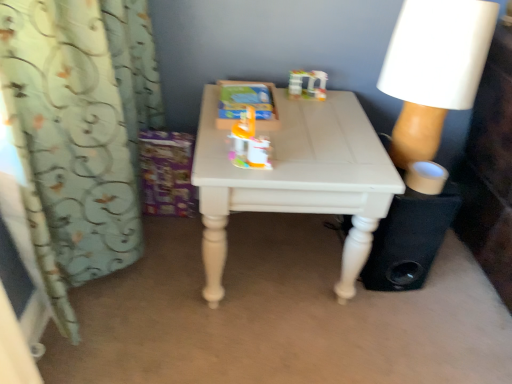
This screenshot has width=512, height=384. I want to click on vacant area that lies between light blue fabric curtain at left and white painted wood table at center, so click(x=191, y=299).